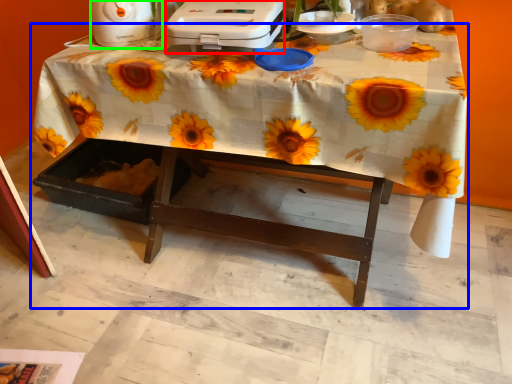
Question: Based on their relative distances, which object is nearer to appliance (highlighted by a red box)? Choose from table (highlighted by a blue box) and appliance (highlighted by a green box).

Choices:
 (A) table
 (B) appliance

Answer: (A)